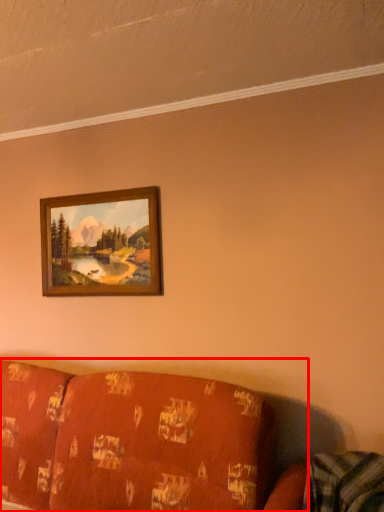
Question: From the image's perspective, what is the correct spatial relationship of studio couch (annotated by the red box) in relation to picture frame?

Choices:
 (A) below
 (B) above

Answer: (A)